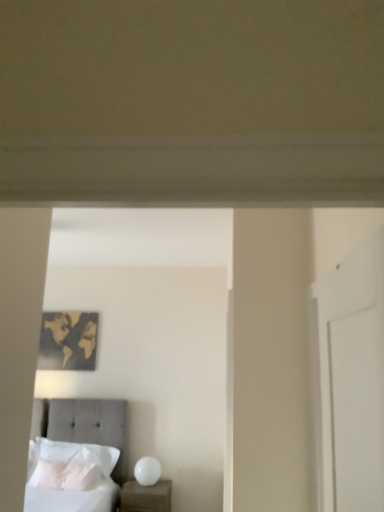
Question: Is white glossy nightstand at lower center inside or outside of white soft pillow at lower left, which is the 1th pillow in front-to-back order?

Choices:
 (A) outside
 (B) inside

Answer: (A)

Question: Looking at the image, does white glossy nightstand at lower center seem bigger or smaller compared to white soft pillow at lower left, which is the 2th pillow in back-to-front order?

Choices:
 (A) small
 (B) big

Answer: (B)

Question: Estimate the real-world distances between objects in this image. Which object is closer to the white glossy nightstand at lower center?

Choices:
 (A) white soft pillow at lower left, which is the 2th pillow in back-to-front order
 (B) white soft pillow at lower left, which ranks as the 2th pillow in front-to-back order
 (C) gold metallic world map at upper left
 (D) tufted fabric bed at lower left

Answer: (A)

Question: Which of these objects is positioned closest to the white soft pillow at lower left, which is the 1th pillow in front-to-back order?

Choices:
 (A) tufted fabric bed at lower left
 (B) white soft pillow at lower left, the first pillow positioned from the back
 (C) white glossy nightstand at lower center
 (D) gold metallic world map at upper left

Answer: (B)